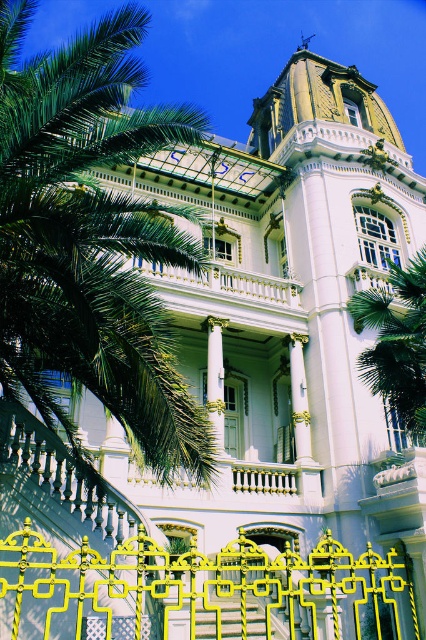
Can you confirm if green leafy palm tree at center is positioned above white marble column at center?

Correct, green leafy palm tree at center is located above white marble column at center.

The height and width of the screenshot is (640, 426). In order to click on green leafy palm tree at center in this screenshot , I will do `click(396, 342)`.

Based on the photo, who is more forward, (416,285) or (218,380)?

Point (416,285) is in front.

Where is `green leafy palm tree at center`? Image resolution: width=426 pixels, height=640 pixels. green leafy palm tree at center is located at coordinates (396, 342).

Who is more forward, (149, 323) or (230, 596)?

Point (149, 323) is more forward.

Locate an element on the screen. The width and height of the screenshot is (426, 640). green leafy palm tree at left is located at coordinates (91, 241).

Can you confirm if yellow metallic stairs at center is thinner than white marble column at center?

No.

Between yellow metallic stairs at center and white marble column at center, which one is positioned higher?

Positioned higher is white marble column at center.

Is point (232, 598) closer to camera compared to point (207, 330)?

Yes, it is in front of point (207, 330).

Locate an element on the screen. The image size is (426, 640). yellow metallic stairs at center is located at coordinates (230, 616).